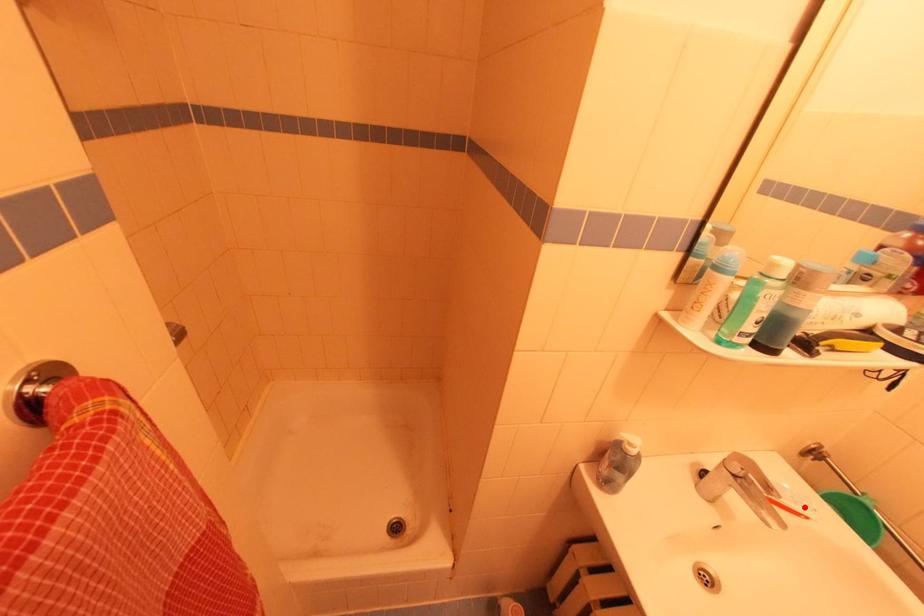
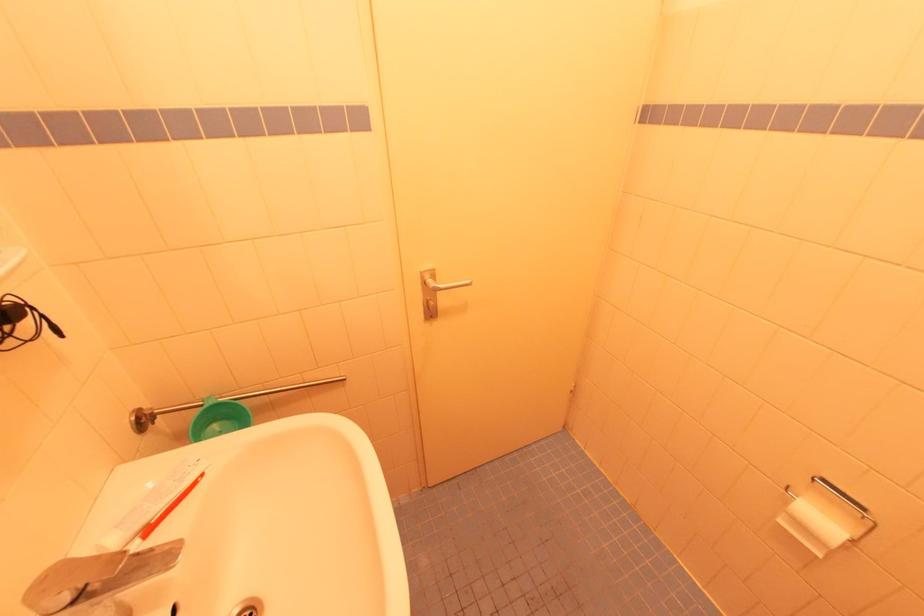
Question: I am providing you with two images of the same scene from different viewpoints. In image1, a red point is highlighted. Considering the same 3D point in image2, which of the following is correct?

Choices:
 (A) It is closer
 (B) It is farther

Answer: (B)